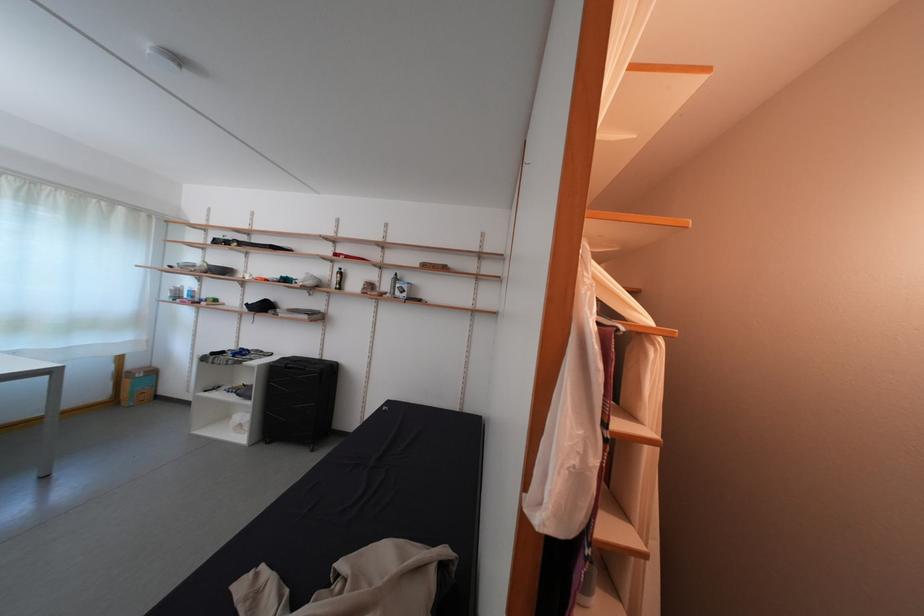
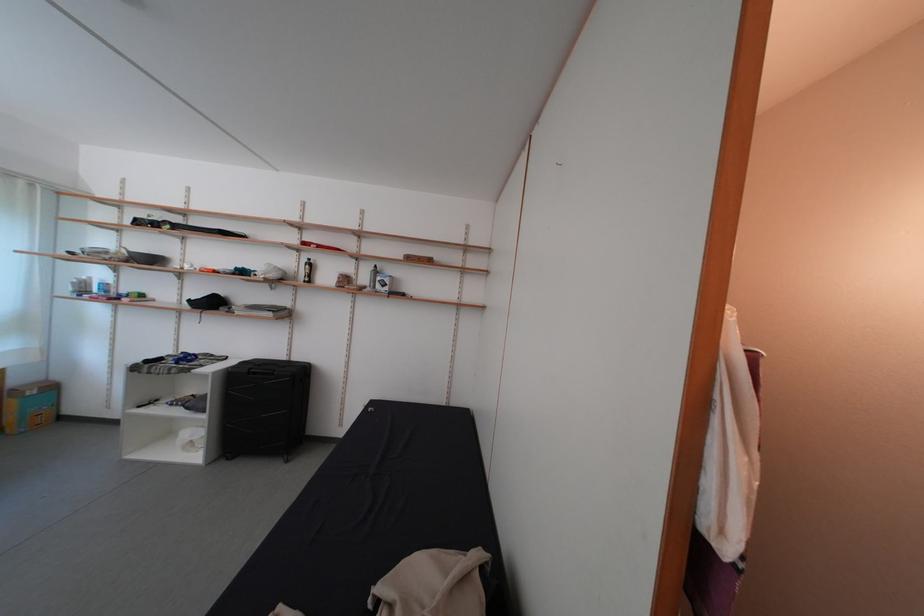
Question: The camera is either moving clockwise (left) or counter-clockwise (right) around the object. The first image is from the beginning of the video and the second image is from the end. Is the camera moving left or right when shooting the video?

Choices:
 (A) Left
 (B) Right

Answer: (A)